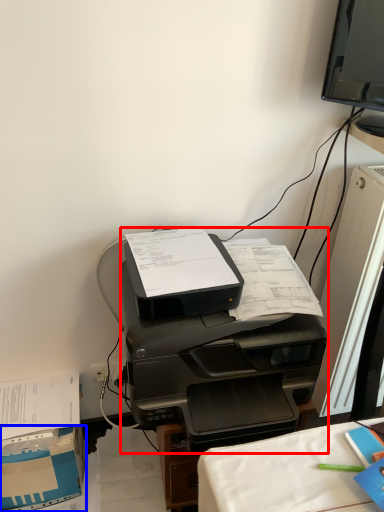
Question: Which of the following is the closest to the observer, printer (highlighted by a red box) or cardboard box (highlighted by a blue box)?

Choices:
 (A) printer
 (B) cardboard box

Answer: (A)